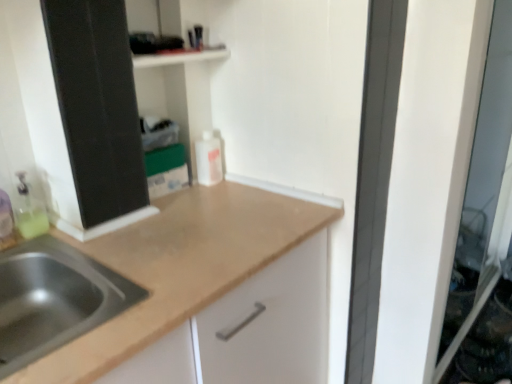
Question: Is white matte bottle at center smaller than transparent glass screen door at right?

Choices:
 (A) no
 (B) yes

Answer: (B)

Question: Is white matte bottle at center not within transparent glass screen door at right?

Choices:
 (A) no
 (B) yes

Answer: (B)

Question: Is transparent glass screen door at right completely or partially inside white matte bottle at center?

Choices:
 (A) yes
 (B) no

Answer: (B)

Question: From a real-world perspective, is white matte bottle at center located beneath transparent glass screen door at right?

Choices:
 (A) no
 (B) yes

Answer: (A)

Question: Is white matte bottle at center bigger than transparent glass screen door at right?

Choices:
 (A) no
 (B) yes

Answer: (A)

Question: In the image, is stainless steel sink at lower left on the left side or the right side of transparent glass screen door at right?

Choices:
 (A) left
 (B) right

Answer: (A)

Question: Based on their sizes in the image, would you say stainless steel sink at lower left is bigger or smaller than transparent glass screen door at right?

Choices:
 (A) big
 (B) small

Answer: (B)

Question: From the image's perspective, is stainless steel sink at lower left above or below transparent glass screen door at right?

Choices:
 (A) above
 (B) below

Answer: (B)

Question: In terms of height, does stainless steel sink at lower left look taller or shorter compared to transparent glass screen door at right?

Choices:
 (A) tall
 (B) short

Answer: (B)

Question: Considering the positions of stainless steel sink at lower left and translucent plastic bottle at left in the image, is stainless steel sink at lower left taller or shorter than translucent plastic bottle at left?

Choices:
 (A) short
 (B) tall

Answer: (A)

Question: Considering the positions of stainless steel sink at lower left and translucent plastic bottle at left in the image, is stainless steel sink at lower left wider or thinner than translucent plastic bottle at left?

Choices:
 (A) wide
 (B) thin

Answer: (A)

Question: Would you say stainless steel sink at lower left is inside or outside translucent plastic bottle at left?

Choices:
 (A) outside
 (B) inside

Answer: (A)

Question: In terms of size, does stainless steel sink at lower left appear bigger or smaller than translucent plastic bottle at left?

Choices:
 (A) big
 (B) small

Answer: (A)

Question: Does point (461, 225) appear closer or farther from the camera than point (74, 301)?

Choices:
 (A) farther
 (B) closer

Answer: (A)

Question: From a real-world perspective, relative to stainless steel sink at lower left, is transparent glass screen door at right vertically above or below?

Choices:
 (A) above
 (B) below

Answer: (B)